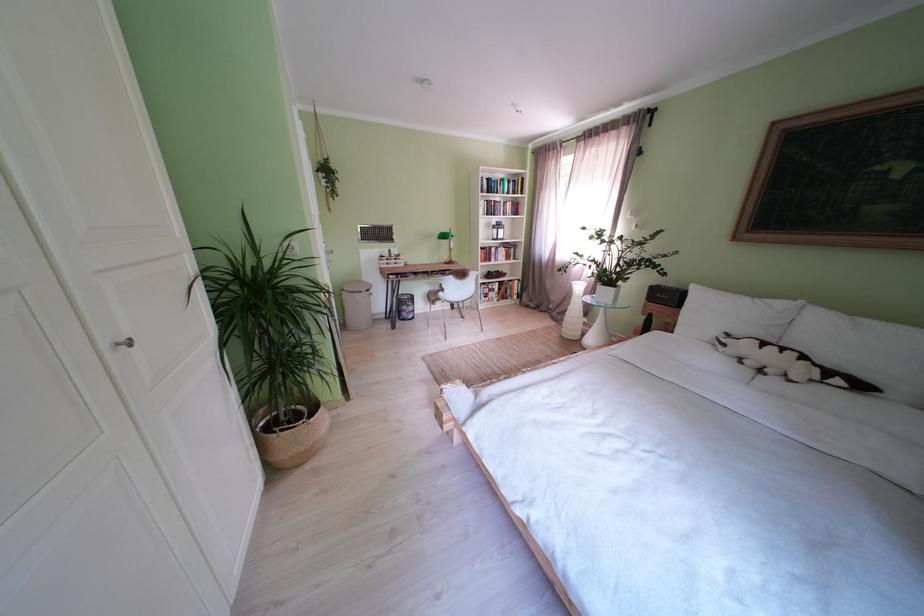
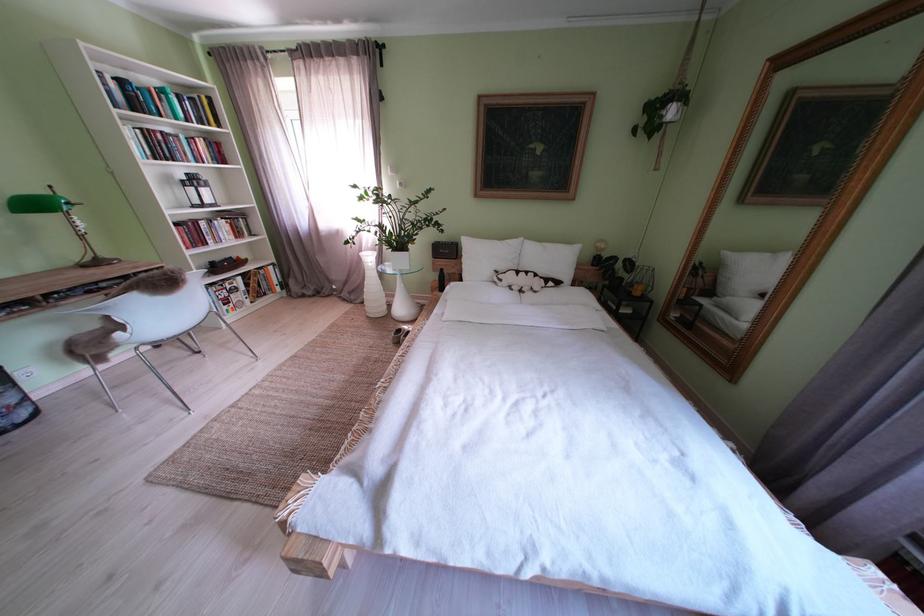
Locate, in the second image, the point that corresponds to point (716, 317) in the first image.

(490, 262)